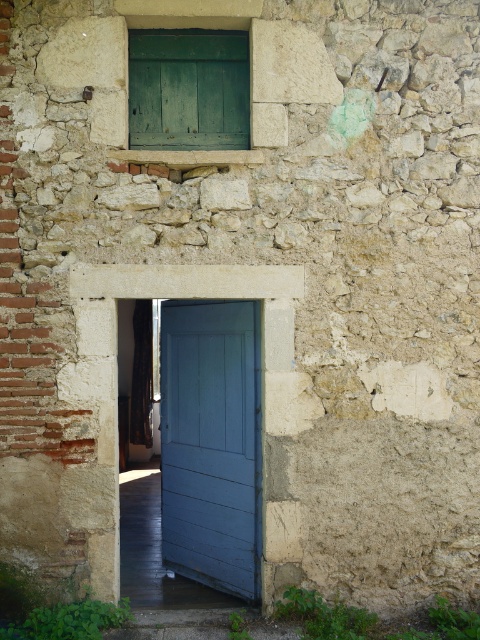
You are a painter who needs to decide which object to paint first. The blue wooden door at center and the green wooden window at upper center are both in need of a fresh coat. Considering their sizes, which one should you tackle first if you want to start with the larger one?

The blue wooden door at center has a larger size compared to the green wooden window at upper center, so you should paint the blue wooden door at center first.

You are standing in front of the rustic stone building and want to enter through the blue wooden door at center. Which direction should you walk relative to the green wooden window at upper center to reach the door?

The blue wooden door at center is below the green wooden window at upper center, so you should walk downward or towards the bottom direction relative to the green wooden window at upper center to reach the door.